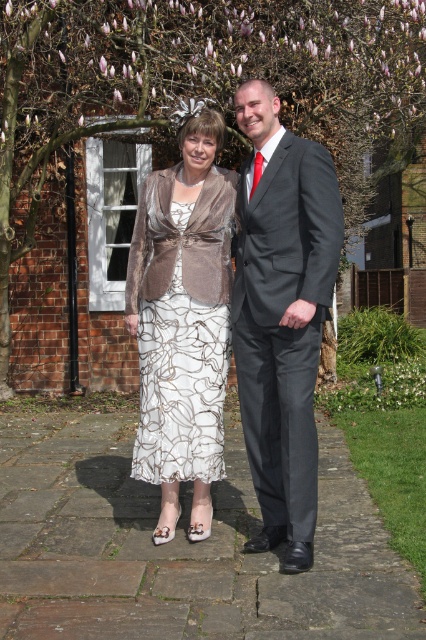
You are a photographer planning to capture a portrait of the two people in the scene. Given that the smooth bark tree at upper center and the matte silver dress at center are both in the frame, which object appears wider in the image?

The matte silver dress at center appears wider because its width is greater than the smooth bark tree at upper center.

In the scene shown: You are a photographer planning to take a group photo of the dark gray suit at center and the matte silver dress at center. Which of the two outfits will require more space to accommodate its width in the frame?

The matte silver dress at center requires more space because it has a greater width than the dark gray suit at center.

You are a photographer standing at the front of the brick building. You want to take a photo of the dark gray suit at center and the smooth bark tree at upper center so that both are clearly visible. Is there any issue with their positions?

The dark gray suit at center is behind the smooth bark tree at upper center, so the tree may block the view of the dark gray suit at center in the photo.